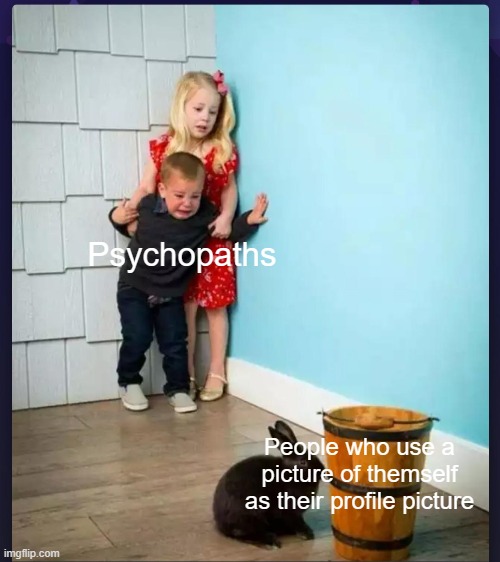
Where is `blue wall`? blue wall is located at coordinates (356, 232).